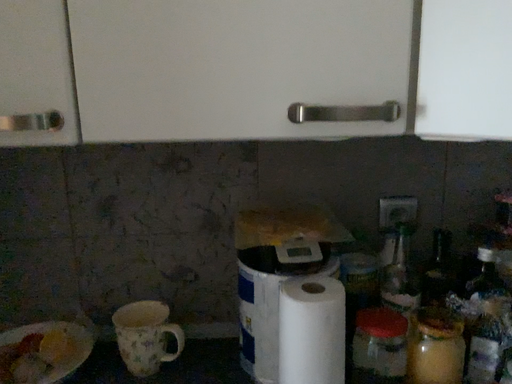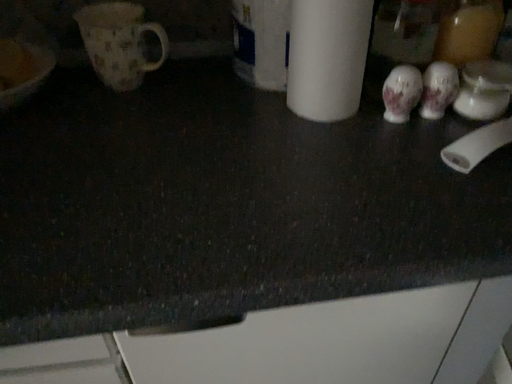
Question: Which way did the camera rotate in the video?

Choices:
 (A) rotated downward
 (B) rotated upward

Answer: (A)